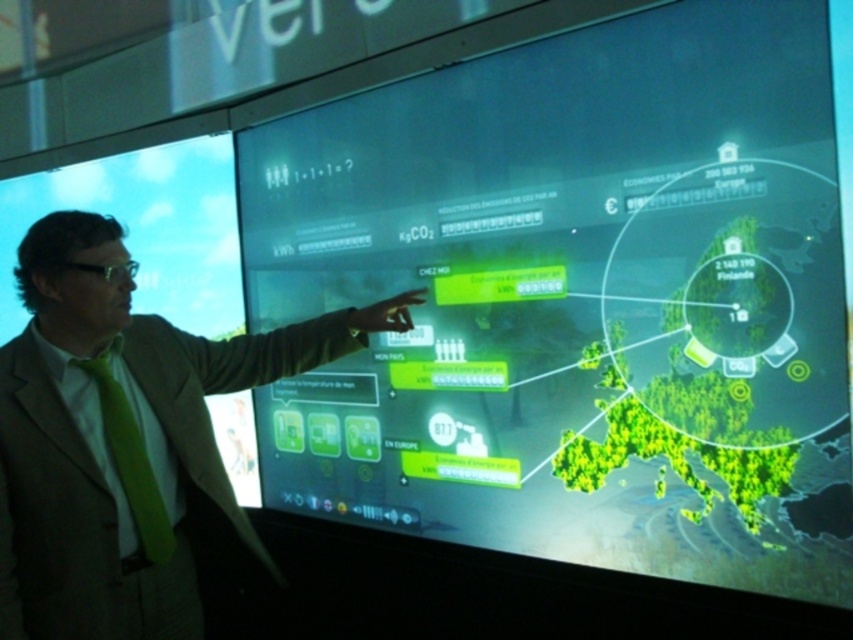
What do you see at coordinates (576, 300) in the screenshot?
I see `green matte map at center` at bounding box center [576, 300].

Is green matte map at center smaller than green silk tie at left?

No.

Image resolution: width=853 pixels, height=640 pixels. Find the location of `green matte map at center`. green matte map at center is located at coordinates (576, 300).

Where is `green matte map at center`? green matte map at center is located at coordinates (576, 300).

Who is shorter, green matte map at center or green matte tie at left?

green matte tie at left

Between green matte map at center and green matte tie at left, which one is positioned lower?

Positioned lower is green matte tie at left.

Between point (277, 278) and point (132, 499), which one is positioned in front?

Point (132, 499)

The image size is (853, 640). In order to click on green matte map at center in this screenshot , I will do `click(576, 300)`.

Is green silk tie at left wider than green matte tie at left?

Indeed, green silk tie at left has a greater width compared to green matte tie at left.

Is point (96, 522) less distant than point (117, 464)?

Yes, it is in front of point (117, 464).

Who is more forward, (193,557) or (132,474)?

Point (132,474) is in front.

Locate an element on the screen. The height and width of the screenshot is (640, 853). green silk tie at left is located at coordinates (131, 449).